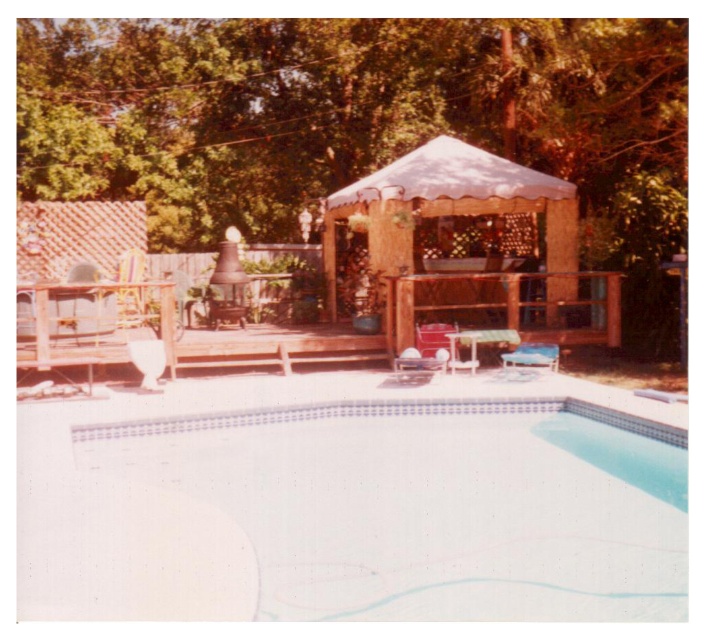
Does wooden gazebo at center appear under wooden chair at lower right?

Incorrect, wooden gazebo at center is not positioned below wooden chair at lower right.

Is wooden gazebo at center above wooden chair at lower right?

Yes, wooden gazebo at center is above wooden chair at lower right.

Find the location of a particular element. The width and height of the screenshot is (704, 640). wooden gazebo at center is located at coordinates coord(472,268).

Does white smooth pool at lower center have a lesser width compared to wooden gazebo at center?

In fact, white smooth pool at lower center might be wider than wooden gazebo at center.

Based on the photo, can you confirm if white smooth pool at lower center is wider than wooden gazebo at center?

Indeed, white smooth pool at lower center has a greater width compared to wooden gazebo at center.

Between point (210, 483) and point (432, 269), which one is positioned behind?

The point (432, 269) is more distant.

Identify the location of white smooth pool at lower center. (x=433, y=502).

Between green leafy tree at upper center and wooden gazebo at center, which one is positioned higher?

green leafy tree at upper center is above.

Between green leafy tree at upper center and wooden gazebo at center, which one has less height?

With less height is wooden gazebo at center.

Locate an element on the screen. green leafy tree at upper center is located at coordinates (360, 122).